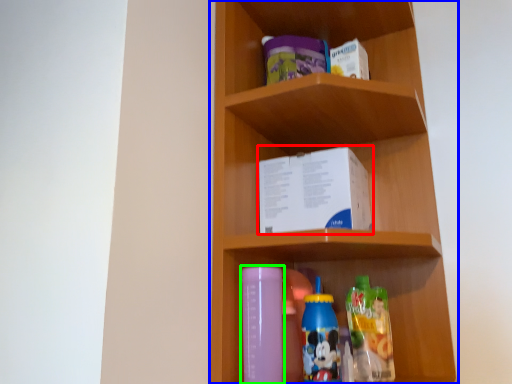
Question: Which object is positioned closest to book (highlighted by a red box)? Select from shelf (highlighted by a blue box) and bottle (highlighted by a green box).

Choices:
 (A) shelf
 (B) bottle

Answer: (A)